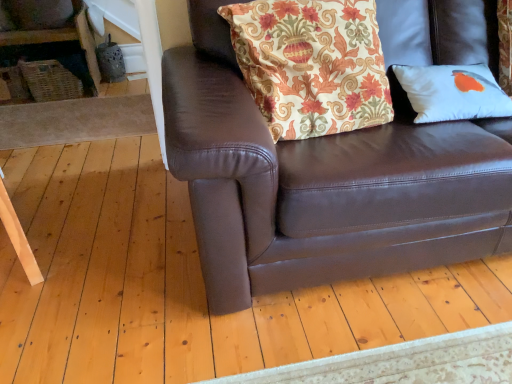
Question: Considering the relative positions of white matte pillow at upper right, which appears as the first pillow when viewed from the right, and brown leather couch at center in the image provided, is white matte pillow at upper right, which appears as the first pillow when viewed from the right, to the left or to the right of brown leather couch at center?

Choices:
 (A) right
 (B) left

Answer: (A)

Question: Is point (430, 82) positioned closer to the camera than point (508, 163)?

Choices:
 (A) closer
 (B) farther

Answer: (B)

Question: Based on their relative distances, which object is nearer to the white matte pillow at upper right, which appears as the first pillow when viewed from the right?

Choices:
 (A) floral fabric cushion at upper center, the 2th pillow viewed from the right
 (B) brown leather couch at center
 (C) matte gray vase at upper left

Answer: (A)

Question: Based on their relative distances, which object is farther from the matte gray vase at upper left?

Choices:
 (A) white matte pillow at upper right, which ranks as the second pillow in left-to-right order
 (B) brown leather couch at center
 (C) floral fabric cushion at upper center, the 2th pillow viewed from the right

Answer: (A)